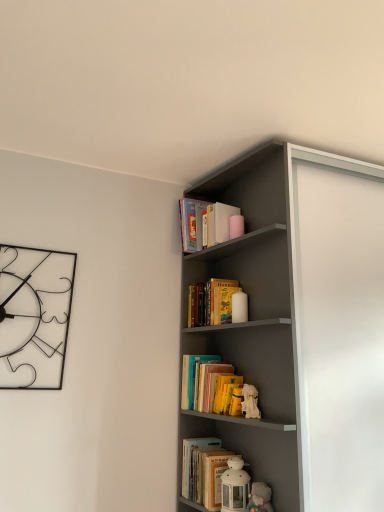
Question: Which direction should I rotate to look at hardcover book at center, arranged as the third book when viewed from the top, — up or down?

Choices:
 (A) down
 (B) up

Answer: (A)

Question: Is white plush toy at middle, arranged as the 2th toy when ordered from the bottom, not inside white matte lantern at lower center, the second toy when ordered from top to bottom?

Choices:
 (A) no
 (B) yes

Answer: (B)

Question: Is white plush toy at middle, arranged as the 2th toy when ordered from the bottom, not near white matte lantern at lower center, the second toy when ordered from top to bottom?

Choices:
 (A) yes
 (B) no

Answer: (B)

Question: From the image's perspective, does white plush toy at middle, which is the 1th toy from top to bottom, appear lower than white matte lantern at lower center, placed as the first toy when sorted from bottom to top?

Choices:
 (A) no
 (B) yes

Answer: (A)

Question: Considering the relative positions of white plush toy at middle, which is the 1th toy from top to bottom, and white matte lantern at lower center, placed as the first toy when sorted from bottom to top, in the image provided, is white plush toy at middle, which is the 1th toy from top to bottom, behind white matte lantern at lower center, placed as the first toy when sorted from bottom to top,?

Choices:
 (A) yes
 (B) no

Answer: (A)

Question: From a real-world perspective, is white plush toy at middle, arranged as the 2th toy when ordered from the bottom, physically below white matte lantern at lower center, placed as the first toy when sorted from bottom to top?

Choices:
 (A) yes
 (B) no

Answer: (B)

Question: From a real-world perspective, is white plush toy at middle, arranged as the 2th toy when ordered from the bottom, on top of white matte lantern at lower center, the second toy when ordered from top to bottom?

Choices:
 (A) no
 (B) yes

Answer: (B)

Question: Could you tell me if yellow paper book at upper center, the 2th book when ordered from top to bottom, is facing hardcover book at upper center, which ranks as the 1th book in back-to-front order?

Choices:
 (A) no
 (B) yes

Answer: (A)

Question: From the image's perspective, does yellow paper book at upper center, which is counted as the 2th book, starting from the bottom, appear higher than hardcover book at upper center, which ranks as the 1th book in back-to-front order?

Choices:
 (A) no
 (B) yes

Answer: (A)

Question: Considering the relative sizes of yellow paper book at upper center, the 2th book when ordered from top to bottom, and hardcover book at upper center, marked as the third book in a front-to-back arrangement, in the image provided, is yellow paper book at upper center, the 2th book when ordered from top to bottom, smaller than hardcover book at upper center, marked as the third book in a front-to-back arrangement,?

Choices:
 (A) yes
 (B) no

Answer: (A)

Question: Is yellow paper book at upper center, the 2th book positioned from the front, looking in the opposite direction of hardcover book at upper center, the 3th book from the bottom?

Choices:
 (A) no
 (B) yes

Answer: (A)

Question: From a real-world perspective, is yellow paper book at upper center, the 2th book positioned from the front, physically above hardcover book at upper center, which ranks as the 1th book in back-to-front order?

Choices:
 (A) yes
 (B) no

Answer: (B)

Question: Does yellow paper book at upper center, the 2th book when ordered from top to bottom, touch hardcover book at upper center, marked as the third book in a front-to-back arrangement?

Choices:
 (A) yes
 (B) no

Answer: (B)

Question: Does hardcover book at center, arranged as the third book when viewed from the top, have a greater height compared to yellow paper book at upper center, the 2th book positioned from the front?

Choices:
 (A) yes
 (B) no

Answer: (B)